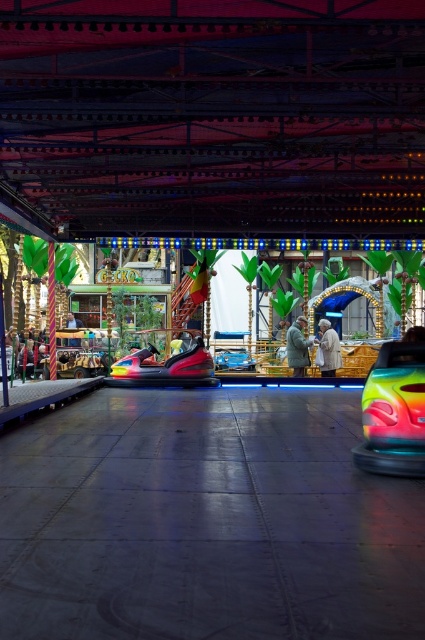
Question: Which of the following is the closest to the observer?

Choices:
 (A) light brown leather jacket at center
 (B) light brown fabric coat at center
 (C) shiny metallic bumper car at center

Answer: (B)

Question: Is rainbow glossy bumper car at center in front of light brown fabric coat at center?

Choices:
 (A) no
 (B) yes

Answer: (B)

Question: Is rainbow plastic bumper car at center to the right of light brown fabric coat at center from the viewer's perspective?

Choices:
 (A) yes
 (B) no

Answer: (B)

Question: Which point is closer to the camera?

Choices:
 (A) (82, 323)
 (B) (323, 344)

Answer: (B)

Question: Is shiny metallic bumper car at center to the right of white fabric coat at center from the viewer's perspective?

Choices:
 (A) yes
 (B) no

Answer: (B)

Question: Which point is farther from the camera taking this photo?

Choices:
 (A) (419, 448)
 (B) (302, 369)
 (C) (102, 243)

Answer: (C)